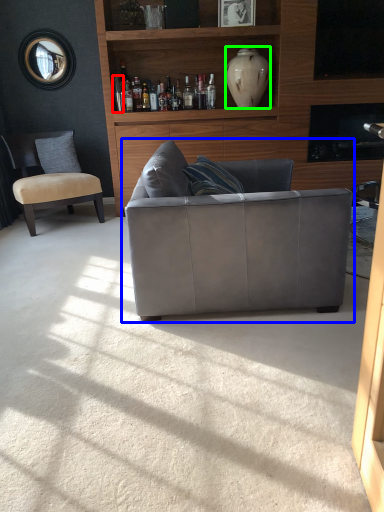
Question: Which object is the farthest from bottle (highlighted by a red box)? Choose among these: studio couch (highlighted by a blue box) or vase (highlighted by a green box).

Choices:
 (A) studio couch
 (B) vase

Answer: (A)